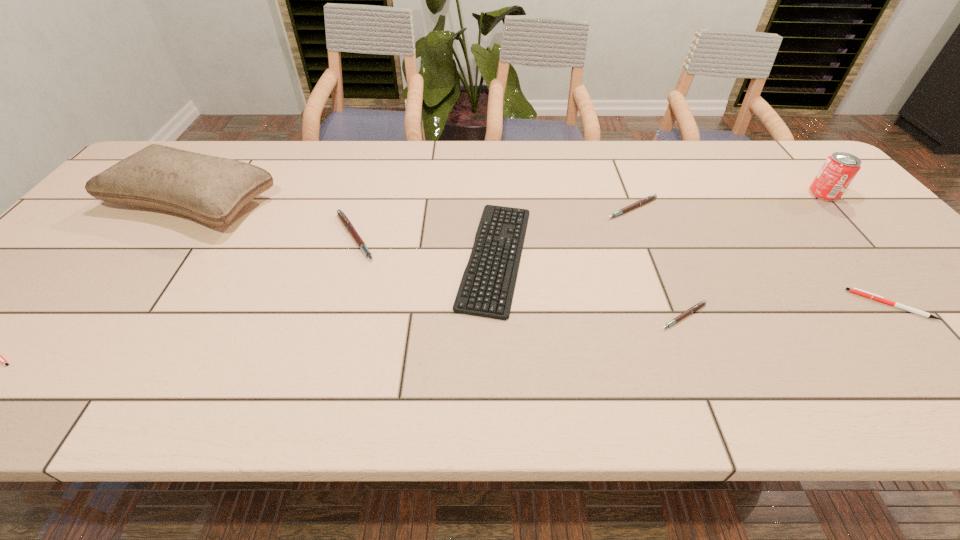
Identify the location of pink pen that is the second closest one to the computer keyboard. Image resolution: width=960 pixels, height=540 pixels. (647, 199).

Select which pink pen is the second closest to the tallest object. Please provide its 2D coordinates. Your answer should be formatted as a tuple, i.e. [(x, y)], where the tuple contains the x and y coordinates of a point satisfying the conditions above.

[(647, 199)]

Locate an element on the screen. This screenshot has height=540, width=960. vacant space that satisfies the following two spatial constraints: 1. at the nib of the biggest pink pen; 2. on the back side of the computer keyboard is located at coordinates (348, 256).